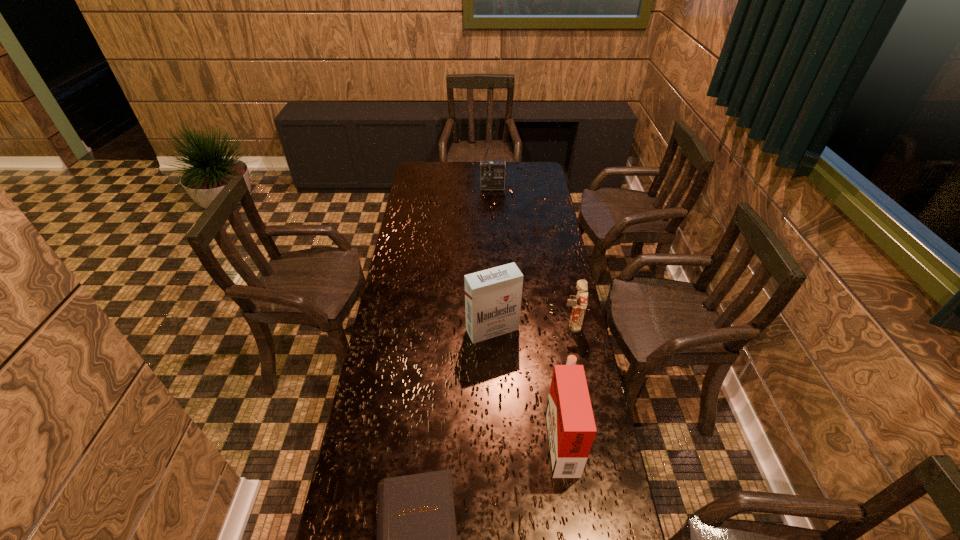
Locate an element on the screen. The image size is (960, 540). free spot between the nearer cigarette case and the farthest object is located at coordinates (527, 312).

You are a GUI agent. You are given a task and a screenshot of the screen. Output one action in this format:
    pyautogui.click(x=<x>, y=<y>)
    Task: Click on the vacant region between the rightmost object and the farthest object
    
    Given the screenshot: What is the action you would take?
    pyautogui.click(x=532, y=257)

Image resolution: width=960 pixels, height=540 pixels. In order to click on unoccupied position between the radio receiver and the fourth object from left to right in this screenshot , I will do `click(527, 312)`.

Identify the location of free space that is in between the left cigarette case and the radio receiver. (492, 259).

Find the location of a particular element. object that ranks as the closest to the radio receiver is located at coordinates (493, 296).

Find the location of `the fourth closest object to the farther cigarette case`. the fourth closest object to the farther cigarette case is located at coordinates (493, 173).

This screenshot has height=540, width=960. Find the location of `vacant space that satisfies the following two spatial constraints: 1. on the front-facing side of the figurine; 2. on the front side of the farther cigarette case`. vacant space that satisfies the following two spatial constraints: 1. on the front-facing side of the figurine; 2. on the front side of the farther cigarette case is located at coordinates (571, 329).